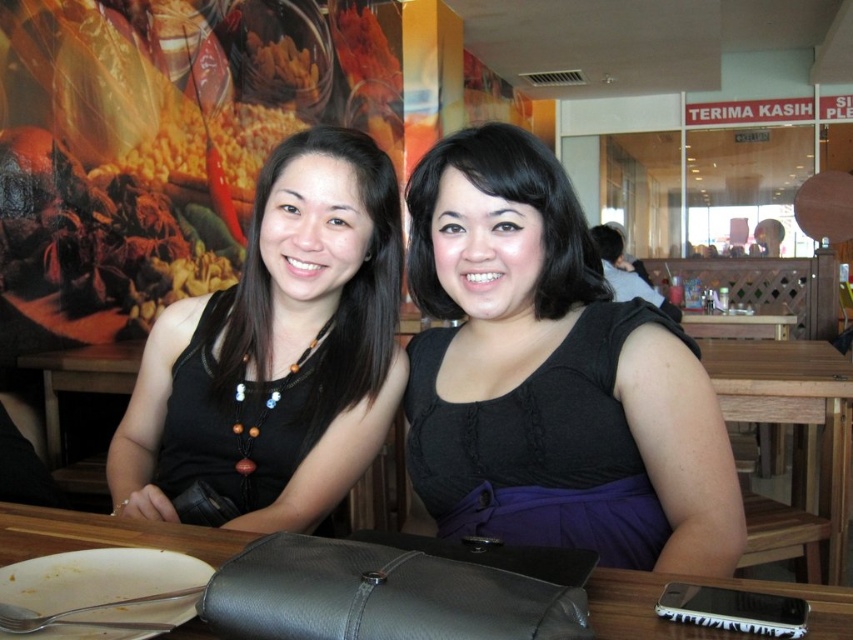
Question: Is yellow popcorn at upper left wider than golden crispy snack at upper center?

Choices:
 (A) yes
 (B) no

Answer: (A)

Question: Estimate the real-world distances between objects in this image. Which object is farther from the golden crispy snack at upper center?

Choices:
 (A) wooden table at lower right
 (B) black matte dress at center
 (C) black matte tank top at center

Answer: (B)

Question: Among these points, which one is nearest to the camera?

Choices:
 (A) (750, 496)
 (B) (392, 204)

Answer: (B)

Question: Is yellow popcorn at upper left further to camera compared to golden crispy snack at upper center?

Choices:
 (A) no
 (B) yes

Answer: (A)

Question: Estimate the real-world distances between objects in this image. Which object is farther from the wooden table at center?

Choices:
 (A) yellow popcorn at upper left
 (B) black matte tank top at center
 (C) wooden table at lower right

Answer: (A)

Question: Considering the relative positions of black matte dress at center and wooden table at lower right in the image provided, where is black matte dress at center located with respect to wooden table at lower right?

Choices:
 (A) right
 (B) left

Answer: (B)